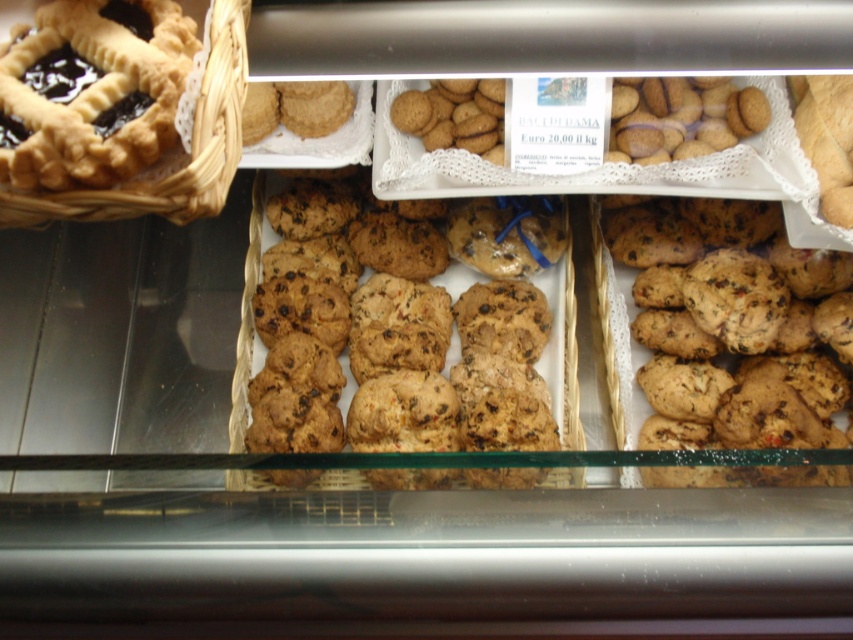
Looking at the display case in the bakery, where is the brown crumbly cookie at center in relation to the woven brown basket at upper left?

The brown crumbly cookie at center is located to the right of the woven brown basket at upper left.

You are a customer at the bakery and want to choose a taller item between the brown crumbly cookie at center and the woven brown basket at upper left. Which one should you pick?

The brown crumbly cookie at center is taller than the woven brown basket at upper left, so you should pick the brown crumbly cookie at center.

You are a customer at the bakery and want to buy the brown crumbly cookie at center and the woven brown basket at upper left. However, you need to know which item is located higher in the display case to reach it first. Can you tell me which one is higher?

The woven brown basket at upper left is higher in the display case than the brown crumbly cookie at center, so you should reach for the woven brown basket at upper left first.